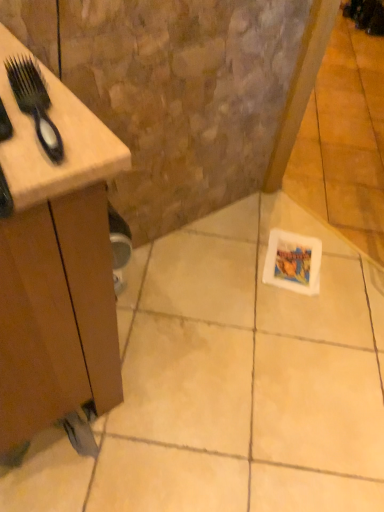
At what (x,y) coordinates should I click in order to perform the action: click on black plastic comb at upper left. Please return your answer as a coordinate pair (x, y). Image resolution: width=384 pixels, height=512 pixels. Looking at the image, I should click on point(34,101).

Image resolution: width=384 pixels, height=512 pixels. What do you see at coordinates (34, 101) in the screenshot?
I see `black plastic comb at upper left` at bounding box center [34, 101].

Identify the location of black plastic comb at upper left. (34, 101).